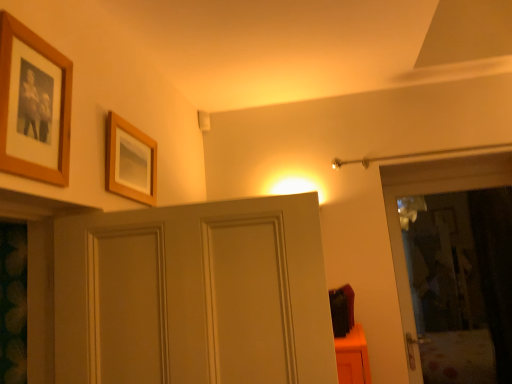
I want to click on wooden picture frame at upper center, marked as the 2th picture frame in a front-to-back arrangement, so click(x=130, y=161).

The width and height of the screenshot is (512, 384). What do you see at coordinates (130, 161) in the screenshot?
I see `wooden picture frame at upper center, which is the second picture frame in left-to-right order` at bounding box center [130, 161].

Find the location of a particular element. The height and width of the screenshot is (384, 512). wooden photo frame at upper left, arranged as the 1th picture frame when viewed from the front is located at coordinates (33, 105).

What do you see at coordinates (33, 105) in the screenshot?
I see `wooden photo frame at upper left, acting as the second picture frame starting from the back` at bounding box center [33, 105].

Identify the location of wooden picture frame at upper center, which is the second picture frame in left-to-right order. (130, 161).

Can you confirm if wooden photo frame at upper left, acting as the second picture frame starting from the back, is positioned to the right of wooden picture frame at upper center, arranged as the 1th picture frame when viewed from the right?

No.

Which is in front, wooden photo frame at upper left, arranged as the 1th picture frame when viewed from the front, or wooden picture frame at upper center, arranged as the 1th picture frame when viewed from the right?

→ wooden photo frame at upper left, arranged as the 1th picture frame when viewed from the front.

Which is less distant, [54,144] or [108,145]?

Clearly, point [54,144] is closer to the camera than point [108,145].

From the image's perspective, which object appears higher, wooden photo frame at upper left, placed as the 2th picture frame when sorted from right to left, or wooden picture frame at upper center, which is the second picture frame in left-to-right order?

wooden photo frame at upper left, placed as the 2th picture frame when sorted from right to left, is shown above in the image.

From a real-world perspective, which object stands above the other?

wooden photo frame at upper left, acting as the second picture frame starting from the back, from a real-world perspective.

Does wooden photo frame at upper left, acting as the second picture frame starting from the back, have a lesser width compared to wooden picture frame at upper center, the first picture frame in the back-to-front sequence?

Yes, wooden photo frame at upper left, acting as the second picture frame starting from the back, is thinner than wooden picture frame at upper center, the first picture frame in the back-to-front sequence.

Considering the relative sizes of wooden photo frame at upper left, arranged as the 1th picture frame when viewed from the front, and wooden picture frame at upper center, which is the second picture frame in left-to-right order, in the image provided, is wooden photo frame at upper left, arranged as the 1th picture frame when viewed from the front, taller than wooden picture frame at upper center, which is the second picture frame in left-to-right order,?

Yes.

Which of these two, wooden photo frame at upper left, placed as the 1th picture frame when sorted from left to right, or wooden picture frame at upper center, arranged as the 1th picture frame when viewed from the right, is smaller?

Smaller between the two is wooden picture frame at upper center, arranged as the 1th picture frame when viewed from the right.

Which is correct: wooden photo frame at upper left, placed as the 2th picture frame when sorted from right to left, is inside wooden picture frame at upper center, marked as the 2th picture frame in a front-to-back arrangement, or outside of it?

wooden photo frame at upper left, placed as the 2th picture frame when sorted from right to left, is outside wooden picture frame at upper center, marked as the 2th picture frame in a front-to-back arrangement.

Is wooden photo frame at upper left, arranged as the 1th picture frame when viewed from the front, placed right next to wooden picture frame at upper center, the first picture frame in the back-to-front sequence?

No, wooden photo frame at upper left, arranged as the 1th picture frame when viewed from the front, is not beside wooden picture frame at upper center, the first picture frame in the back-to-front sequence.

Could you tell me if wooden photo frame at upper left, arranged as the 1th picture frame when viewed from the front, is turned towards wooden picture frame at upper center, arranged as the 1th picture frame when viewed from the right?

No.

Based on the photo, how many degrees apart are the facing directions of wooden photo frame at upper left, acting as the second picture frame starting from the back, and wooden picture frame at upper center, which is the second picture frame in left-to-right order?

The angular difference between wooden photo frame at upper left, acting as the second picture frame starting from the back, and wooden picture frame at upper center, which is the second picture frame in left-to-right order, is 1.33 degrees.

Where is `picture frame above the wooden picture frame at upper center, marked as the 2th picture frame in a front-to-back arrangement (from a real-world perspective)`? The height and width of the screenshot is (384, 512). picture frame above the wooden picture frame at upper center, marked as the 2th picture frame in a front-to-back arrangement (from a real-world perspective) is located at coordinates (33, 105).

Can you confirm if wooden picture frame at upper center, marked as the 2th picture frame in a front-to-back arrangement, is positioned to the left of wooden photo frame at upper left, acting as the second picture frame starting from the back?

Answer: Incorrect, wooden picture frame at upper center, marked as the 2th picture frame in a front-to-back arrangement, is not on the left side of wooden photo frame at upper left, acting as the second picture frame starting from the back.

Is the depth of wooden picture frame at upper center, which is the second picture frame in left-to-right order, less than that of wooden photo frame at upper left, placed as the 2th picture frame when sorted from right to left?

No, it is behind wooden photo frame at upper left, placed as the 2th picture frame when sorted from right to left.

Does point (150, 153) lie behind point (25, 101)?

Yes, it is.

From the image's perspective, which is above, wooden picture frame at upper center, the first picture frame in the back-to-front sequence, or wooden photo frame at upper left, acting as the second picture frame starting from the back?

wooden photo frame at upper left, acting as the second picture frame starting from the back.

From a real-world perspective, does wooden picture frame at upper center, arranged as the 1th picture frame when viewed from the right, sit lower than wooden photo frame at upper left, placed as the 2th picture frame when sorted from right to left?

Indeed, from a real-world perspective, wooden picture frame at upper center, arranged as the 1th picture frame when viewed from the right, is positioned beneath wooden photo frame at upper left, placed as the 2th picture frame when sorted from right to left.

In the scene shown: Considering the sizes of wooden picture frame at upper center, which is the second picture frame in left-to-right order, and wooden photo frame at upper left, arranged as the 1th picture frame when viewed from the front, in the image, is wooden picture frame at upper center, which is the second picture frame in left-to-right order, wider or thinner than wooden photo frame at upper left, arranged as the 1th picture frame when viewed from the front,?

In the image, wooden picture frame at upper center, which is the second picture frame in left-to-right order, appears to be wider than wooden photo frame at upper left, arranged as the 1th picture frame when viewed from the front.

Based on the photo, in terms of height, does wooden picture frame at upper center, arranged as the 1th picture frame when viewed from the right, look taller or shorter compared to wooden photo frame at upper left, acting as the second picture frame starting from the back?

Clearly, wooden picture frame at upper center, arranged as the 1th picture frame when viewed from the right, is shorter compared to wooden photo frame at upper left, acting as the second picture frame starting from the back.

Between wooden picture frame at upper center, arranged as the 1th picture frame when viewed from the right, and wooden photo frame at upper left, arranged as the 1th picture frame when viewed from the front, which one has larger size?

Bigger between the two is wooden photo frame at upper left, arranged as the 1th picture frame when viewed from the front.

Looking at this image, is wooden picture frame at upper center, marked as the 2th picture frame in a front-to-back arrangement, situated inside wooden photo frame at upper left, acting as the second picture frame starting from the back, or outside?

wooden picture frame at upper center, marked as the 2th picture frame in a front-to-back arrangement, is not inside wooden photo frame at upper left, acting as the second picture frame starting from the back, it's outside.

Is wooden picture frame at upper center, marked as the 2th picture frame in a front-to-back arrangement, in contact with wooden photo frame at upper left, placed as the 1th picture frame when sorted from left to right?

They are not placed beside each other.

Could you tell me if wooden picture frame at upper center, which is the second picture frame in left-to-right order, is facing wooden photo frame at upper left, placed as the 1th picture frame when sorted from left to right?

No, wooden picture frame at upper center, which is the second picture frame in left-to-right order, is not aimed at wooden photo frame at upper left, placed as the 1th picture frame when sorted from left to right.

Can you tell me how much wooden picture frame at upper center, marked as the 2th picture frame in a front-to-back arrangement, and wooden photo frame at upper left, placed as the 2th picture frame when sorted from right to left, differ in facing direction?

The facing directions of wooden picture frame at upper center, marked as the 2th picture frame in a front-to-back arrangement, and wooden photo frame at upper left, placed as the 2th picture frame when sorted from right to left, are 1.33 degrees apart.

I want to click on picture frame to the left of wooden picture frame at upper center, marked as the 2th picture frame in a front-to-back arrangement, so click(x=33, y=105).

The height and width of the screenshot is (384, 512). Find the location of `picture frame above the wooden picture frame at upper center, the first picture frame in the back-to-front sequence (from the image's perspective)`. picture frame above the wooden picture frame at upper center, the first picture frame in the back-to-front sequence (from the image's perspective) is located at coordinates (33, 105).

I want to click on picture frame that is under the wooden photo frame at upper left, acting as the second picture frame starting from the back (from a real-world perspective), so click(x=130, y=161).